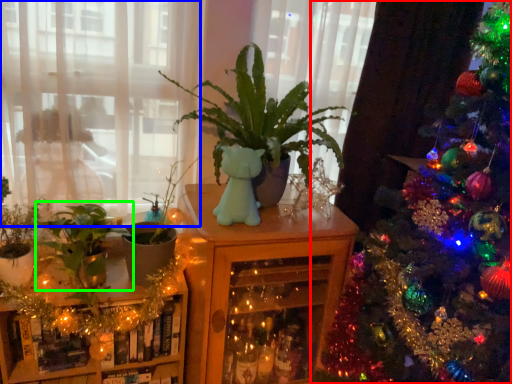
Question: Considering the real-world distances, which object is closest to christmas tree (highlighted by a red box)? window (highlighted by a blue box) or houseplant (highlighted by a green box).

Choices:
 (A) window
 (B) houseplant

Answer: (B)